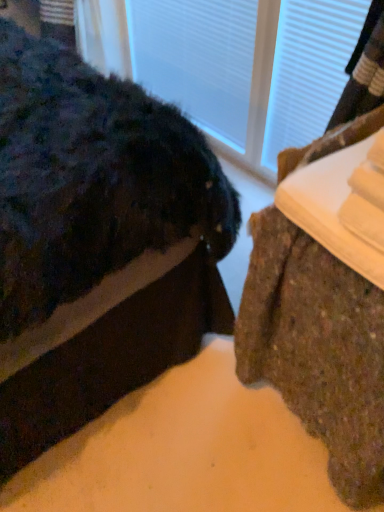
What do you see at coordinates (247, 65) in the screenshot? The height and width of the screenshot is (512, 384). I see `transparent glass door at upper center` at bounding box center [247, 65].

How much space does brown textured rug at lower right, the second furniture when ordered from left to right, occupy horizontally?

The width of brown textured rug at lower right, the second furniture when ordered from left to right, is 25.14 inches.

Locate an element on the screen. The height and width of the screenshot is (512, 384). transparent glass door at upper center is located at coordinates (247, 65).

From the image's perspective, is brown textured rug at lower right, the 1th furniture when ordered from left to right, beneath brown textured rug at lower right, the second furniture when ordered from left to right?

No, from the image's perspective, brown textured rug at lower right, the 1th furniture when ordered from left to right, is not below brown textured rug at lower right, the second furniture when ordered from left to right.

Between brown textured rug at lower right, the 1th furniture when ordered from left to right, and brown textured rug at lower right, the second furniture when ordered from left to right, which one appears on the left side from the viewer's perspective?

brown textured rug at lower right, the 1th furniture when ordered from left to right.

How many degrees apart are the facing directions of brown textured rug at lower right, the 1th furniture when ordered from left to right, and brown textured rug at lower right, marked as the 1th furniture in a right-to-left arrangement?

The angle between the facing direction of brown textured rug at lower right, the 1th furniture when ordered from left to right, and the facing direction of brown textured rug at lower right, marked as the 1th furniture in a right-to-left arrangement, is 92.3 degrees.

Based on the photo, are brown textured rug at lower right, marked as the 1th furniture in a right-to-left arrangement, and brown textured rug at lower right, the 2th furniture positioned from the right, located far from each other?

No, there isn't a large distance between brown textured rug at lower right, marked as the 1th furniture in a right-to-left arrangement, and brown textured rug at lower right, the 2th furniture positioned from the right.

Considering the sizes of objects brown textured rug at lower right, the second furniture when ordered from left to right, and brown textured rug at lower right, the 1th furniture when ordered from left to right, in the image provided, who is taller, brown textured rug at lower right, the second furniture when ordered from left to right, or brown textured rug at lower right, the 1th furniture when ordered from left to right,?

brown textured rug at lower right, the 1th furniture when ordered from left to right.

Is brown textured rug at lower right, the 1th furniture when ordered from left to right, located within brown textured rug at lower right, the second furniture when ordered from left to right?

No, brown textured rug at lower right, the 1th furniture when ordered from left to right, is not surrounded by brown textured rug at lower right, the second furniture when ordered from left to right.

Which of these two, brown textured rug at lower right, the 2th furniture positioned from the right, or transparent glass door at upper center, is wider?

brown textured rug at lower right, the 2th furniture positioned from the right, is wider.

From a real-world perspective, is brown textured rug at lower right, the 2th furniture positioned from the right, located beneath transparent glass door at upper center?

No, from a real-world perspective, brown textured rug at lower right, the 2th furniture positioned from the right, is not below transparent glass door at upper center.

Can you confirm if brown textured rug at lower right, the 2th furniture positioned from the right, is taller than transparent glass door at upper center?

Yes.

Would you say brown textured rug at lower right, the 1th furniture when ordered from left to right, is outside transparent glass door at upper center?

Yes, brown textured rug at lower right, the 1th furniture when ordered from left to right, is located beyond the bounds of transparent glass door at upper center.

In terms of width, does transparent glass door at upper center look wider or thinner when compared to brown textured rug at lower right, the 2th furniture positioned from the right?

Considering their sizes, transparent glass door at upper center looks slimmer than brown textured rug at lower right, the 2th furniture positioned from the right.

Based on their positions, is transparent glass door at upper center located to the left or right of brown textured rug at lower right, the 2th furniture positioned from the right?

transparent glass door at upper center is positioned on brown textured rug at lower right, the 2th furniture positioned from the right,'s right side.

This screenshot has width=384, height=512. There is a transparent glass door at upper center. In order to click on the 1st furniture below it (from the image's perspective) in this screenshot , I will do `click(97, 242)`.

Looking at this image, considering the sizes of objects transparent glass door at upper center and brown textured rug at lower right, the 2th furniture positioned from the right, in the image provided, who is smaller, transparent glass door at upper center or brown textured rug at lower right, the 2th furniture positioned from the right,?

transparent glass door at upper center.

Does brown textured rug at lower right, marked as the 1th furniture in a right-to-left arrangement, have a greater width compared to transparent glass door at upper center?

Correct, the width of brown textured rug at lower right, marked as the 1th furniture in a right-to-left arrangement, exceeds that of transparent glass door at upper center.

Is point (342, 351) closer or farther from the camera than point (340, 52)?

Point (342, 351) appears to be closer to the viewer than point (340, 52).

Is brown textured rug at lower right, marked as the 1th furniture in a right-to-left arrangement, inside the boundaries of transparent glass door at upper center, or outside?

brown textured rug at lower right, marked as the 1th furniture in a right-to-left arrangement, exists outside the volume of transparent glass door at upper center.

Is the surface of brown textured rug at lower right, the second furniture when ordered from left to right, in direct contact with transparent glass door at upper center?

No, brown textured rug at lower right, the second furniture when ordered from left to right, is not touching transparent glass door at upper center.

Considering the sizes of objects transparent glass door at upper center and brown textured rug at lower right, marked as the 1th furniture in a right-to-left arrangement, in the image provided, who is smaller, transparent glass door at upper center or brown textured rug at lower right, marked as the 1th furniture in a right-to-left arrangement,?

transparent glass door at upper center is smaller.

Considering the sizes of objects transparent glass door at upper center and brown textured rug at lower right, marked as the 1th furniture in a right-to-left arrangement, in the image provided, who is shorter, transparent glass door at upper center or brown textured rug at lower right, marked as the 1th furniture in a right-to-left arrangement,?

brown textured rug at lower right, marked as the 1th furniture in a right-to-left arrangement.

From a real-world perspective, is transparent glass door at upper center located higher than brown textured rug at lower right, marked as the 1th furniture in a right-to-left arrangement?

Yes.

Find the location of a particular element. The image size is (384, 512). furniture on the left of brown textured rug at lower right, the second furniture when ordered from left to right is located at coordinates (97, 242).

Locate an element on the screen. furniture above the brown textured rug at lower right, marked as the 1th furniture in a right-to-left arrangement (from a real-world perspective) is located at coordinates (97, 242).

Estimate the real-world distances between objects in this image. Which object is further from transparent glass door at upper center, brown textured rug at lower right, marked as the 1th furniture in a right-to-left arrangement, or brown textured rug at lower right, the 2th furniture positioned from the right?

brown textured rug at lower right, marked as the 1th furniture in a right-to-left arrangement, is positioned further to the anchor transparent glass door at upper center.

Estimate the real-world distances between objects in this image. Which object is closer to brown textured rug at lower right, the second furniture when ordered from left to right, transparent glass door at upper center or brown textured rug at lower right, the 1th furniture when ordered from left to right?

brown textured rug at lower right, the 1th furniture when ordered from left to right, is positioned closer to the anchor brown textured rug at lower right, the second furniture when ordered from left to right.

Based on their spatial positions, is brown textured rug at lower right, the 2th furniture positioned from the right, or brown textured rug at lower right, marked as the 1th furniture in a right-to-left arrangement, further from transparent glass door at upper center?

Among the two, brown textured rug at lower right, marked as the 1th furniture in a right-to-left arrangement, is located further to transparent glass door at upper center.

When comparing their distances from brown textured rug at lower right, the 1th furniture when ordered from left to right, does brown textured rug at lower right, the second furniture when ordered from left to right, or transparent glass door at upper center seem closer?

brown textured rug at lower right, the second furniture when ordered from left to right.

Which object lies further to the anchor point brown textured rug at lower right, the second furniture when ordered from left to right, brown textured rug at lower right, the 1th furniture when ordered from left to right, or transparent glass door at upper center?

The object further to brown textured rug at lower right, the second furniture when ordered from left to right, is transparent glass door at upper center.

When comparing their distances from brown textured rug at lower right, the 2th furniture positioned from the right, does transparent glass door at upper center or brown textured rug at lower right, marked as the 1th furniture in a right-to-left arrangement, seem further?

The object further to brown textured rug at lower right, the 2th furniture positioned from the right, is transparent glass door at upper center.

Identify the location of glass door located between brown textured rug at lower right, the 2th furniture positioned from the right, and brown textured rug at lower right, the second furniture when ordered from left to right, in the left-right direction. (247, 65).